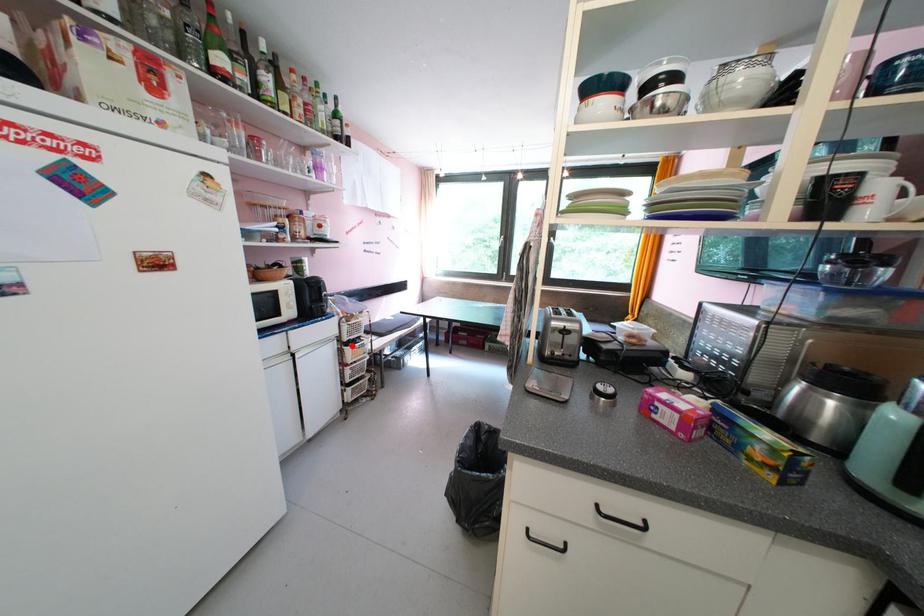
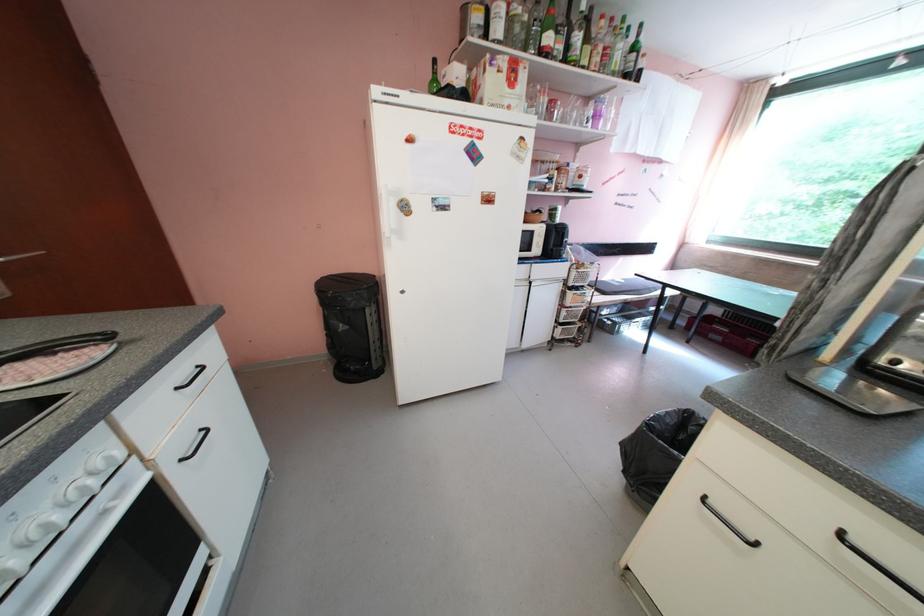
Find the pixel in the second image that matches the highlighted location in the first image.

(576, 290)